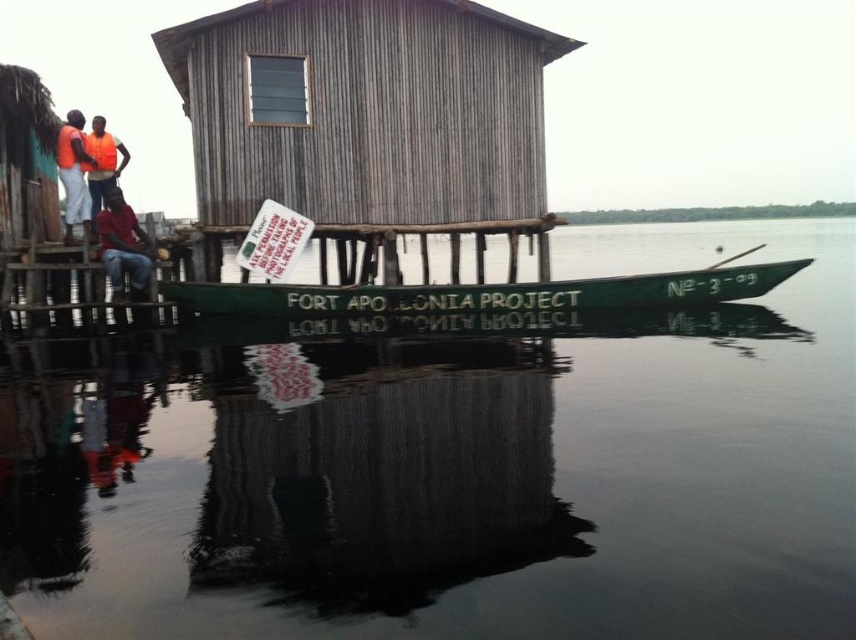
Question: Estimate the real-world distances between objects in this image. Which object is farther from the matte red shirt at center?

Choices:
 (A) orange reflective vest at left
 (B) wooden hut at center
 (C) white paper sign at center
 (D) green matte canoe at center

Answer: (B)

Question: Among these objects, which one is nearest to the camera?

Choices:
 (A) orange reflective vest at left
 (B) orange life vest at left

Answer: (B)

Question: Does green matte canoe at center have a lesser width compared to orange life vest at left?

Choices:
 (A) no
 (B) yes

Answer: (A)

Question: Does green matte canoe at center appear over matte red shirt at center?

Choices:
 (A) no
 (B) yes

Answer: (A)

Question: Considering the relative positions of green smooth water at lower center and green matte canoe at center in the image provided, where is green smooth water at lower center located with respect to green matte canoe at center?

Choices:
 (A) right
 (B) left

Answer: (A)

Question: Which object is farther from the camera taking this photo?

Choices:
 (A) green matte canoe at center
 (B) orange reflective vest at left
 (C) matte red shirt at center
 (D) orange life vest at left

Answer: (B)